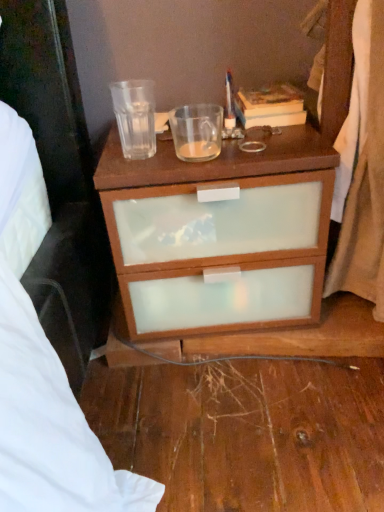
Question: Does white fabric curtain at right lie in front of hardcover book at upper right?

Choices:
 (A) yes
 (B) no

Answer: (A)

Question: Is hardcover book at upper right inside white fabric curtain at right?

Choices:
 (A) yes
 (B) no

Answer: (B)

Question: From the image's perspective, is white fabric curtain at right on top of hardcover book at upper right?

Choices:
 (A) yes
 (B) no

Answer: (B)

Question: Is white fabric curtain at right with hardcover book at upper right?

Choices:
 (A) yes
 (B) no

Answer: (B)

Question: Is white fabric curtain at right smaller than hardcover book at upper right?

Choices:
 (A) yes
 (B) no

Answer: (B)

Question: In the image, is translucent glass coffee cup at upper center, which appears as the 1th coffee cup when viewed from the right, on the left side or the right side of transparent glass at upper center, the 1th coffee cup from the left?

Choices:
 (A) left
 (B) right

Answer: (B)

Question: In terms of width, does translucent glass coffee cup at upper center, marked as the second coffee cup in a left-to-right arrangement, look wider or thinner when compared to transparent glass at upper center, the 1th coffee cup from the left?

Choices:
 (A) thin
 (B) wide

Answer: (B)

Question: Is translucent glass coffee cup at upper center, marked as the second coffee cup in a left-to-right arrangement, spatially inside transparent glass at upper center, the 1th coffee cup from the left, or outside of it?

Choices:
 (A) inside
 (B) outside

Answer: (B)

Question: Considering their positions, is translucent glass coffee cup at upper center, marked as the second coffee cup in a left-to-right arrangement, located in front of or behind transparent glass at upper center, marked as the 2th coffee cup in a right-to-left arrangement?

Choices:
 (A) front
 (B) behind

Answer: (B)

Question: Based on their positions, is hardcover book at upper right located to the left or right of brown matte drawer at center?

Choices:
 (A) right
 (B) left

Answer: (A)

Question: Considering the positions of hardcover book at upper right and brown matte drawer at center in the image, is hardcover book at upper right wider or thinner than brown matte drawer at center?

Choices:
 (A) wide
 (B) thin

Answer: (B)

Question: Considering the positions of hardcover book at upper right and brown matte drawer at center in the image, is hardcover book at upper right taller or shorter than brown matte drawer at center?

Choices:
 (A) short
 (B) tall

Answer: (A)

Question: From the image's perspective, is hardcover book at upper right positioned above or below brown matte drawer at center?

Choices:
 (A) above
 (B) below

Answer: (A)

Question: Considering the positions of point (349, 212) and point (235, 113), is point (349, 212) closer or farther from the camera than point (235, 113)?

Choices:
 (A) closer
 (B) farther

Answer: (A)

Question: Visually, is white fabric curtain at right positioned to the left or to the right of hardcover book at upper right?

Choices:
 (A) right
 (B) left

Answer: (A)